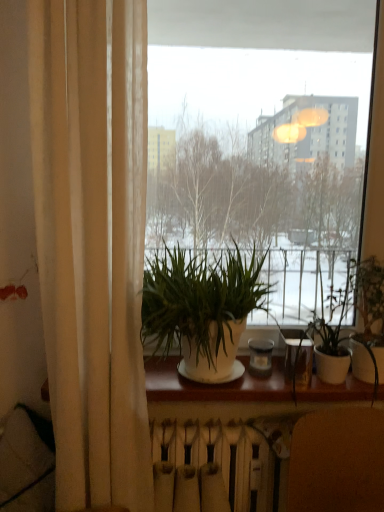
Describe the element at coordinates (360, 314) in the screenshot. I see `green leafy plant at center, which is the 2th houseplant in left-to-right order` at that location.

Describe the element at coordinates (201, 309) in the screenshot. I see `white matte plant pot at center, which is the first houseplant from left to right` at that location.

What do you see at coordinates (92, 242) in the screenshot? I see `beige fabric curtain at left` at bounding box center [92, 242].

What do you see at coordinates (215, 385) in the screenshot? I see `white matte wood at center` at bounding box center [215, 385].

Find the location of a particular element. green leafy plant at center, the first houseplant viewed from the right is located at coordinates (360, 314).

Which point is more forward, (364, 326) or (120, 215)?

The point (120, 215) is in front.

How many degrees apart are the facing directions of green leafy plant at center, the first houseplant viewed from the right, and beige fabric curtain at left?

0.317 degrees separate the facing orientations of green leafy plant at center, the first houseplant viewed from the right, and beige fabric curtain at left.

From a real-world perspective, who is located lower, green leafy plant at center, which is the 2th houseplant in left-to-right order, or beige fabric curtain at left?

green leafy plant at center, which is the 2th houseplant in left-to-right order, is physically lower.

How far apart are green leafy plant at center, which is the 2th houseplant in left-to-right order, and beige fabric curtain at left?

They are 85.90 centimeters apart.

Are white matte wood at center and green leafy plant at center, the first houseplant viewed from the right, making contact?

white matte wood at center is not next to green leafy plant at center, the first houseplant viewed from the right, and they're not touching.

Measure the distance from white matte wood at center to green leafy plant at center, which is the 2th houseplant in left-to-right order.

white matte wood at center and green leafy plant at center, which is the 2th houseplant in left-to-right order, are 25.77 centimeters apart from each other.

What are the coordinates of `window sill that appears below the green leafy plant at center, which is the 2th houseplant in left-to-right order (from the image's perspective)` in the screenshot? It's located at (215, 385).

Could you tell me if white matte wood at center is facing green leafy plant at center, which is the 2th houseplant in left-to-right order?

No, white matte wood at center is not aimed at green leafy plant at center, which is the 2th houseplant in left-to-right order.

From a real-world perspective, which object rests below the other?

From a 3D spatial view, white matte radiator at lower center is below.

Is white matte radiator at lower center far away from white matte wood at center?

No.

Consider the image. Is the depth of white matte radiator at lower center greater than that of white matte wood at center?

Yes.

Can you confirm if white matte radiator at lower center is taller than white matte wood at center?

Correct, white matte radiator at lower center is much taller as white matte wood at center.

Which of these two, transparent glass window at center or green leafy plant at center, the first houseplant viewed from the right, is wider?

With larger width is green leafy plant at center, the first houseplant viewed from the right.

Relative to green leafy plant at center, the first houseplant viewed from the right, is transparent glass window at center in front or behind?

transparent glass window at center is positioned farther from the viewer than green leafy plant at center, the first houseplant viewed from the right.

What's the angular difference between transparent glass window at center and green leafy plant at center, which is the 2th houseplant in left-to-right order,'s facing directions?

0.000388 degrees.

Could green leafy plant at center, which is the 2th houseplant in left-to-right order, be considered to be inside transparent glass window at center?

No, green leafy plant at center, which is the 2th houseplant in left-to-right order, is not a part of transparent glass window at center.

From a real-world perspective, is beige fabric curtain at left physically above white matte plant pot at center, the 2th houseplant when ordered from right to left?

Yes.

Could you tell me if beige fabric curtain at left is turned towards white matte plant pot at center, the 2th houseplant when ordered from right to left?

No.

Considering the relative positions of beige fabric curtain at left and white matte plant pot at center, which is the first houseplant from left to right, in the image provided, is beige fabric curtain at left to the left of white matte plant pot at center, which is the first houseplant from left to right, from the viewer's perspective?

Indeed, beige fabric curtain at left is positioned on the left side of white matte plant pot at center, which is the first houseplant from left to right.

Between beige fabric curtain at left and white matte plant pot at center, which is the first houseplant from left to right, which one has larger width?

white matte plant pot at center, which is the first houseplant from left to right.

Would you say brown leather armchair at lower right is inside or outside green leafy plant at center, the first houseplant viewed from the right?

brown leather armchair at lower right exists outside the volume of green leafy plant at center, the first houseplant viewed from the right.

From the image's perspective, is brown leather armchair at lower right over green leafy plant at center, the first houseplant viewed from the right?

No.

From the image's perspective, relative to beige fabric curtain at left, is white matte plant pot at center, the 2th houseplant when ordered from right to left, above or below?

From the image's perspective, white matte plant pot at center, the 2th houseplant when ordered from right to left, appears below beige fabric curtain at left.

In terms of width, does white matte plant pot at center, the 2th houseplant when ordered from right to left, look wider or thinner when compared to beige fabric curtain at left?

Considering their sizes, white matte plant pot at center, the 2th houseplant when ordered from right to left, looks broader than beige fabric curtain at left.

How different are the orientations of white matte plant pot at center, the 2th houseplant when ordered from right to left, and beige fabric curtain at left in degrees?

There is a 0.317-degree angle between the facing directions of white matte plant pot at center, the 2th houseplant when ordered from right to left, and beige fabric curtain at left.

Is white matte plant pot at center, the 2th houseplant when ordered from right to left, to the left of beige fabric curtain at left from the viewer's perspective?

In fact, white matte plant pot at center, the 2th houseplant when ordered from right to left, is to the right of beige fabric curtain at left.

Starting from the beige fabric curtain at left, which houseplant is the 2nd one to the right? Please provide its 2D coordinates.

[(360, 314)]

Starting from the white matte wood at center, which houseplant is the 1st one in front? Please provide its 2D coordinates.

[(360, 314)]

Based on their spatial positions, is beige fabric curtain at left or white matte radiator at lower center closer to white matte wood at center?

white matte radiator at lower center.

Looking at the image, which one is located further to brown leather armchair at lower right, beige fabric curtain at left or white matte plant pot at center, the 2th houseplant when ordered from right to left?

The object further to brown leather armchair at lower right is beige fabric curtain at left.

Looking at the image, which one is located closer to green leafy plant at center, which is the 2th houseplant in left-to-right order, white matte radiator at lower center or white matte plant pot at center, which is the first houseplant from left to right?

The object closer to green leafy plant at center, which is the 2th houseplant in left-to-right order, is white matte plant pot at center, which is the first houseplant from left to right.

Which object lies further to the anchor point transparent glass window at center, white matte wood at center or white matte plant pot at center, which is the first houseplant from left to right?

Based on the image, white matte wood at center appears to be further to transparent glass window at center.

When comparing their distances from white matte radiator at lower center, does green leafy plant at center, which is the 2th houseplant in left-to-right order, or transparent glass window at center seem further?

The object further to white matte radiator at lower center is transparent glass window at center.

From the image, which object appears to be farther from brown leather armchair at lower right, transparent glass window at center or beige fabric curtain at left?

The object further to brown leather armchair at lower right is transparent glass window at center.

Based on their spatial positions, is green leafy plant at center, the first houseplant viewed from the right, or transparent glass window at center closer to beige fabric curtain at left?

green leafy plant at center, the first houseplant viewed from the right, is closer to beige fabric curtain at left.

Looking at this image, considering their positions, is green leafy plant at center, which is the 2th houseplant in left-to-right order, positioned further to brown leather armchair at lower right than white matte radiator at lower center?

Among the two, green leafy plant at center, which is the 2th houseplant in left-to-right order, is located further to brown leather armchair at lower right.

Identify the location of curtain that lies between transparent glass window at center and white matte wood at center from top to bottom. [92, 242].

In order to click on window sill between beige fabric curtain at left and green leafy plant at center, which is the 2th houseplant in left-to-right order in this screenshot , I will do `click(215, 385)`.

You are a GUI agent. You are given a task and a screenshot of the screen. Output one action in this format:
    pyautogui.click(x=<x>, y=<y>)
    Task: Click on the curtain between transparent glass window at center and brown leather armchair at lower right in the vertical direction
    The image size is (384, 512).
    Given the screenshot: What is the action you would take?
    pyautogui.click(x=92, y=242)

You are a GUI agent. You are given a task and a screenshot of the screen. Output one action in this format:
    pyautogui.click(x=<x>, y=<y>)
    Task: Click on the window situated between beige fabric curtain at left and green leafy plant at center, the first houseplant viewed from the right, from left to right
    
    Given the screenshot: What is the action you would take?
    pyautogui.click(x=294, y=47)